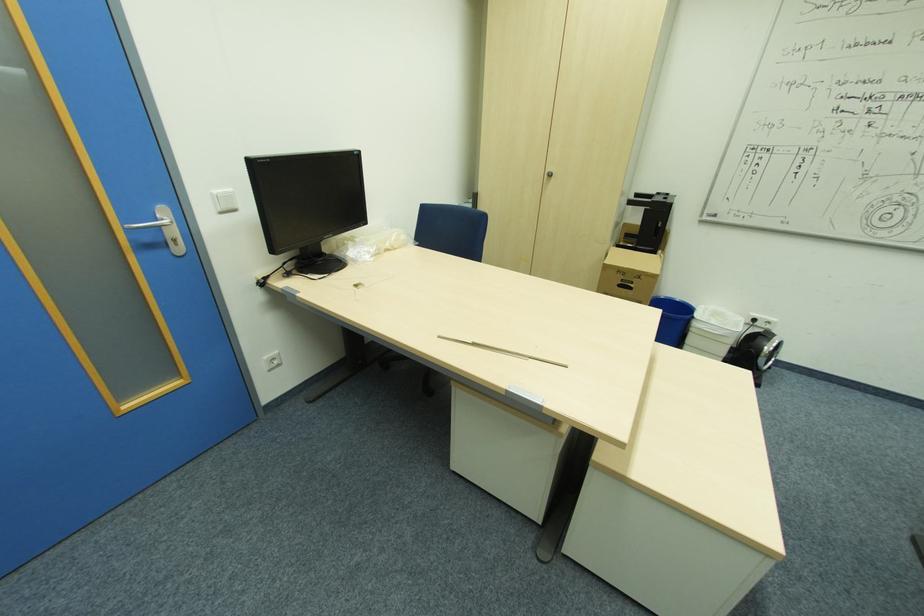
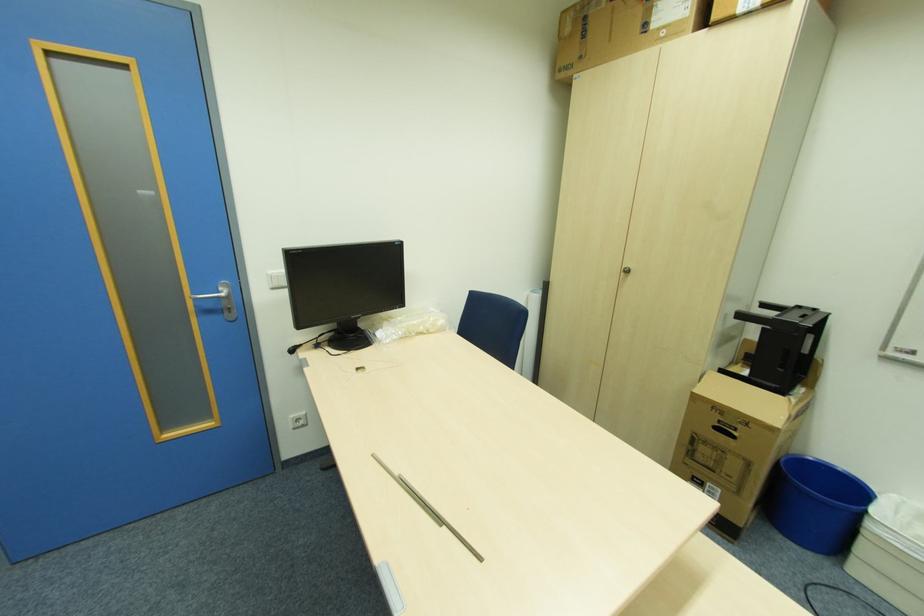
Locate, in the second image, the point that corresponds to pixel 641 277 in the first image.

(748, 424)